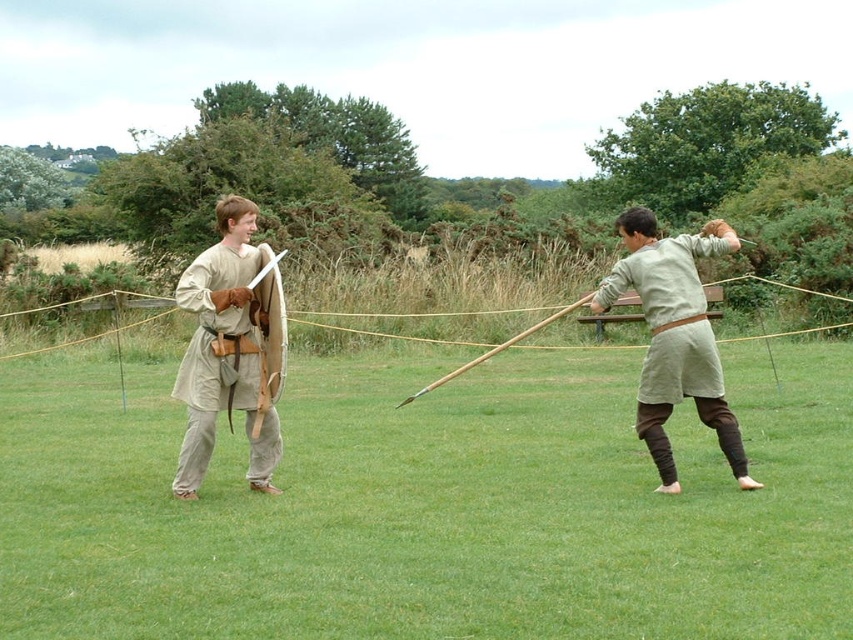
Does light beige fabric shirt at left have a greater height compared to light beige fabric shirt at right?

No, light beige fabric shirt at left is not taller than light beige fabric shirt at right.

Who is shorter, light beige fabric shirt at left or light beige fabric shirt at right?

Standing shorter between the two is light beige fabric shirt at left.

This screenshot has width=853, height=640. Describe the element at coordinates (225, 353) in the screenshot. I see `light beige fabric shirt at left` at that location.

Image resolution: width=853 pixels, height=640 pixels. I want to click on light beige fabric shirt at left, so click(x=225, y=353).

Is green grass at center positioned in front of light beige fabric shirt at right?

That is True.

At what (x,y) coordinates should I click in order to perform the action: click on green grass at center. Please return your answer as a coordinate pair (x, y). Looking at the image, I should click on (431, 506).

The width and height of the screenshot is (853, 640). Describe the element at coordinates (431, 506) in the screenshot. I see `green grass at center` at that location.

Can you confirm if green grass at center is shorter than light beige fabric shirt at left?

Indeed, green grass at center has a lesser height compared to light beige fabric shirt at left.

Where is `green grass at center`? This screenshot has width=853, height=640. green grass at center is located at coordinates (431, 506).